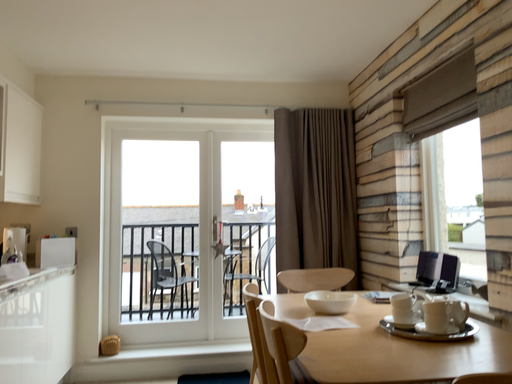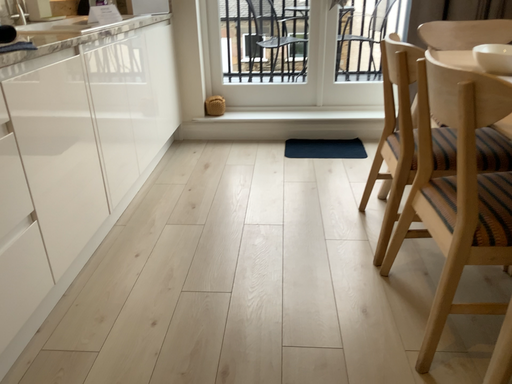
Question: How did the camera likely rotate when shooting the video?

Choices:
 (A) rotated downward
 (B) rotated upward

Answer: (A)